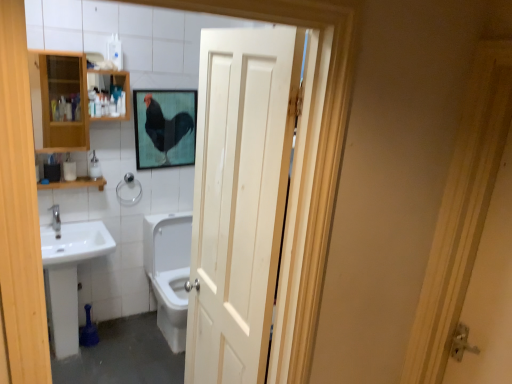
Identify the location of free spot below white glossy sink at left (from a real-world perspective). (82, 351).